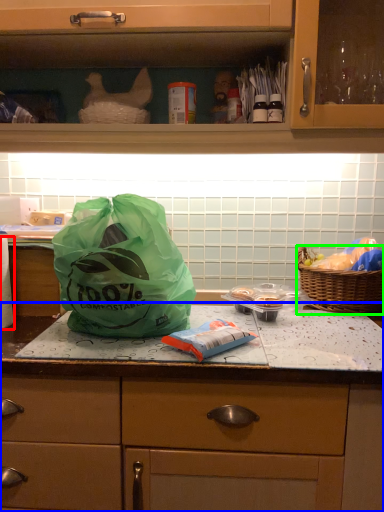
Question: Based on their relative distances, which object is nearer to toilet paper (highlighted by a red box)? Choose from countertop (highlighted by a blue box) and picnic basket (highlighted by a green box).

Choices:
 (A) countertop
 (B) picnic basket

Answer: (A)